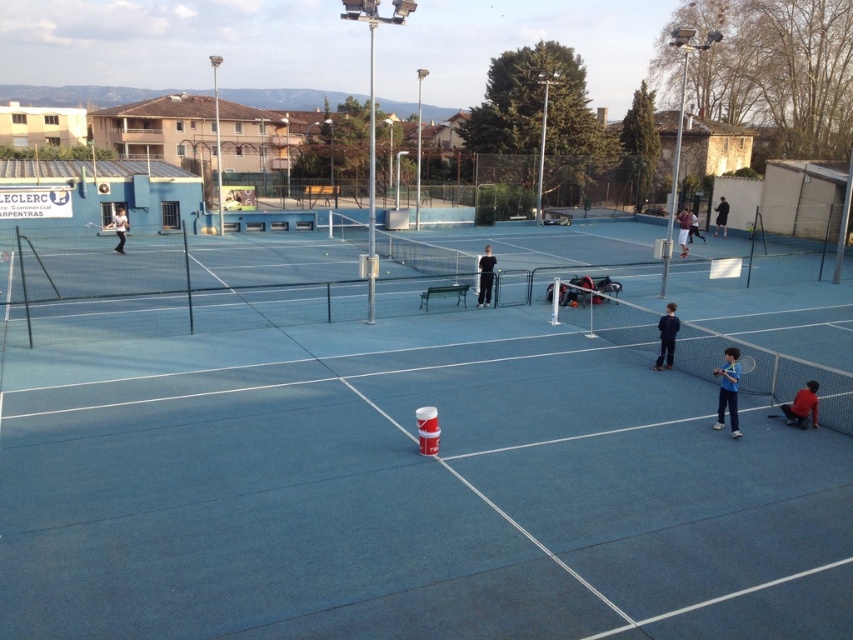
The height and width of the screenshot is (640, 853). Find the location of `dark blue fabric at center`. dark blue fabric at center is located at coordinates (666, 337).

Who is more distant from viewer, (666, 353) or (683, 244)?

The point (683, 244) is more distant.

In order to click on dark blue fabric at center in this screenshot , I will do `click(666, 337)`.

Between point (120, 234) and point (740, 365), which one is positioned in front?

Positioned in front is point (740, 365).

Does matte white tennis racket at upper left have a smaller size compared to blue matte tennis racket at center?

Yes.

Looking at this image, who is more forward, (117, 209) or (741, 360)?

Positioned in front is point (741, 360).

Where is `matte white tennis racket at upper left`? matte white tennis racket at upper left is located at coordinates (119, 228).

Is dark blue fabric at center shorter than black fabric person at right?

Yes.

Measure the distance between point (x=675, y=333) and camera.

They are 13.90 meters apart.

This screenshot has width=853, height=640. What do you see at coordinates (666, 337) in the screenshot?
I see `dark blue fabric at center` at bounding box center [666, 337].

The height and width of the screenshot is (640, 853). What are the coordinates of `dark blue fabric at center` in the screenshot? It's located at (666, 337).